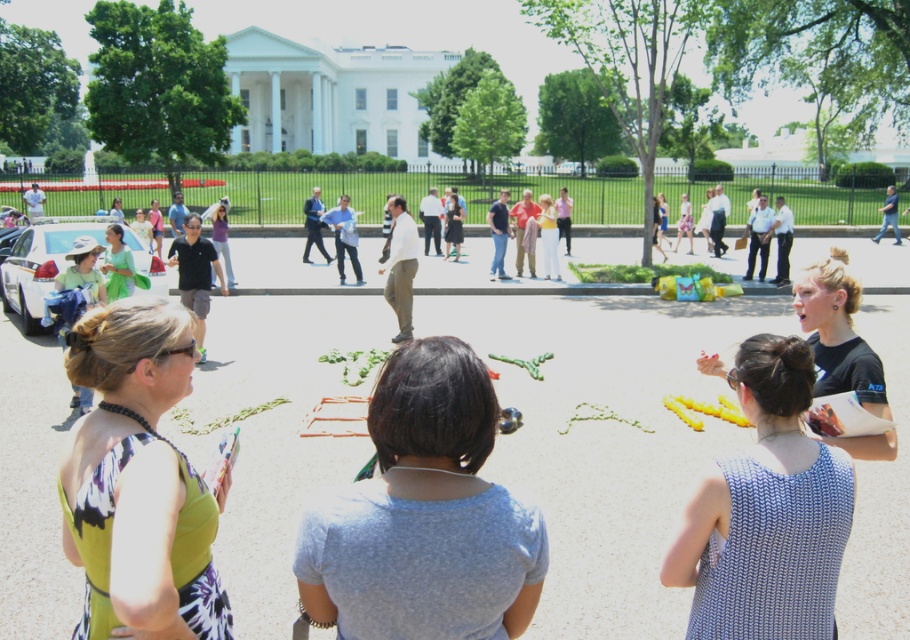
Question: Does white knitted tank top at center appear on the left side of matte green dress at center?

Choices:
 (A) no
 (B) yes

Answer: (A)

Question: Which point is farther from the camera taking this photo?

Choices:
 (A) (182, 385)
 (B) (130, 262)

Answer: (B)

Question: Can you confirm if white knitted tank top at center is positioned to the left of matte green dress at center?

Choices:
 (A) no
 (B) yes

Answer: (A)

Question: Which object appears farthest from the camera in this image?

Choices:
 (A) gray matte shirt at center
 (B) black matte shirt at lower right

Answer: (B)

Question: Does gray matte shirt at center have a lesser width compared to white knitted tank top at center?

Choices:
 (A) no
 (B) yes

Answer: (A)

Question: Which of the following is the closest to the observer?

Choices:
 (A) (685, 547)
 (B) (79, 275)
 (C) (500, 497)
 (D) (704, 356)

Answer: (C)